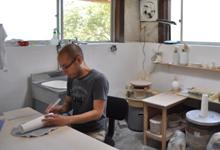
Locate an element on the screen. The width and height of the screenshot is (220, 150). windows is located at coordinates (40, 23), (83, 23), (196, 25).